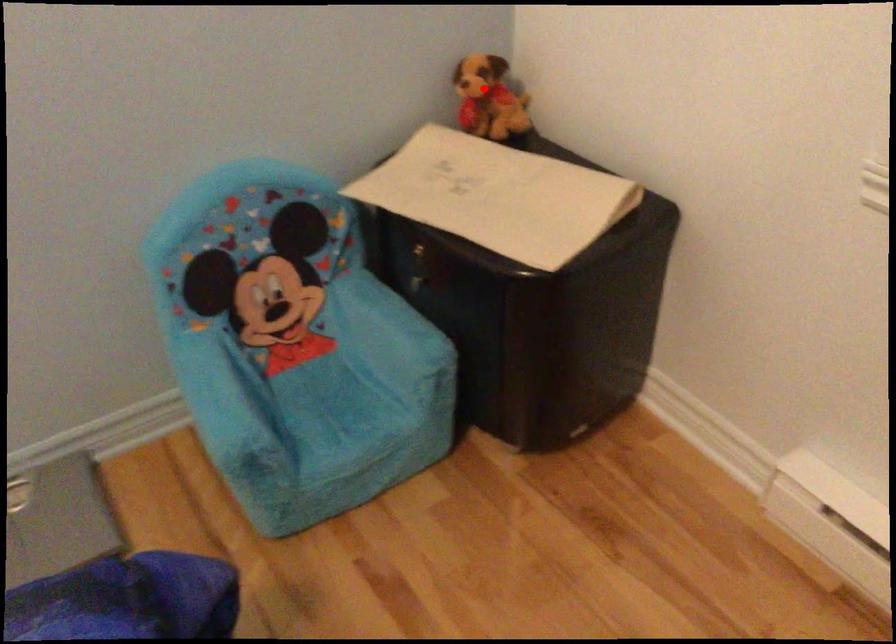
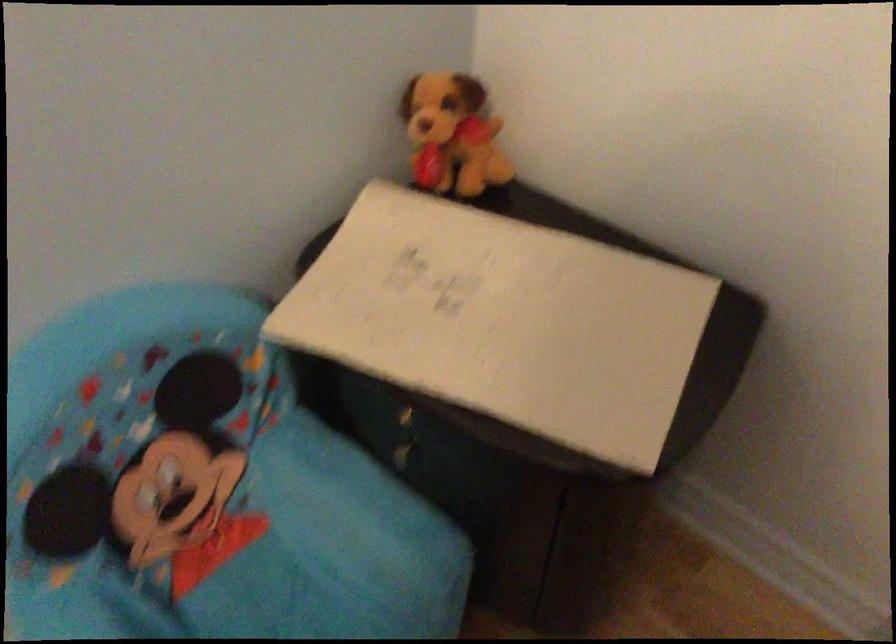
Locate, in the second image, the point that corresponds to the highlighted location in the first image.

(452, 134)